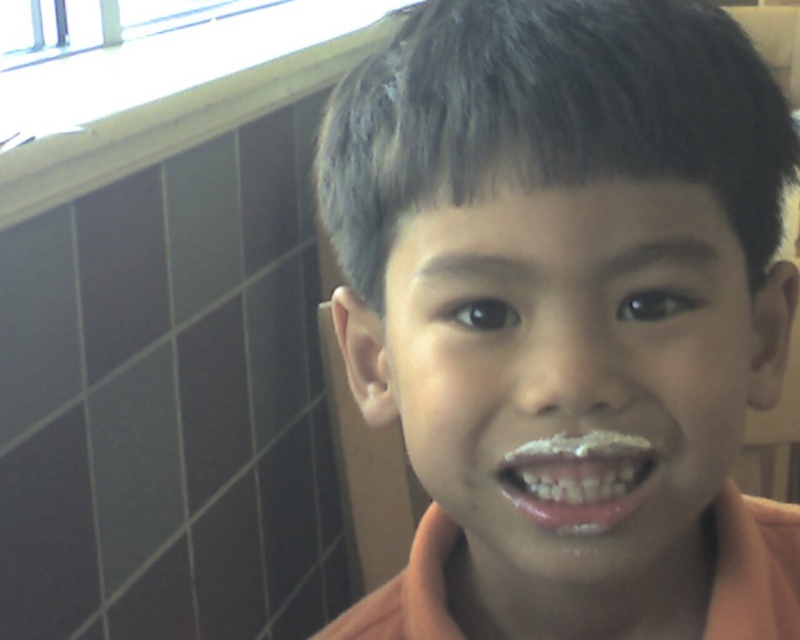
Describe the element at coordinates (572, 371) in the screenshot. This screenshot has width=800, height=640. I see `smooth skin face at center` at that location.

Which is above, smooth skin face at center or shiny pink lips at center?

Positioned higher is smooth skin face at center.

Is point (636, 196) in front of point (580, 436)?

Yes, point (636, 196) is in front of point (580, 436).

This screenshot has height=640, width=800. Identify the location of smooth skin face at center. (572, 371).

Is orange matte shirt at center to the right of smooth skin face at center from the viewer's perspective?

In fact, orange matte shirt at center is to the left of smooth skin face at center.

Who is more distant from viewer, (672, 86) or (464, 230)?

The point (464, 230) is more distant.

Between point (524, 96) and point (570, 368), which one is positioned in front?

Point (524, 96) is in front.

Find the location of a particular element. The height and width of the screenshot is (640, 800). orange matte shirt at center is located at coordinates (568, 312).

Can you confirm if orange matte shirt at center is bigger than white glossy frosting at mouth?

Yes, orange matte shirt at center is bigger than white glossy frosting at mouth.

Is orange matte shirt at center smaller than white glossy frosting at mouth?

Incorrect, orange matte shirt at center is not smaller in size than white glossy frosting at mouth.

You are a GUI agent. You are given a task and a screenshot of the screen. Output one action in this format:
    pyautogui.click(x=<x>, y=<y>)
    Task: Click on the orange matte shirt at center
    The width and height of the screenshot is (800, 640).
    Given the screenshot: What is the action you would take?
    pyautogui.click(x=568, y=312)